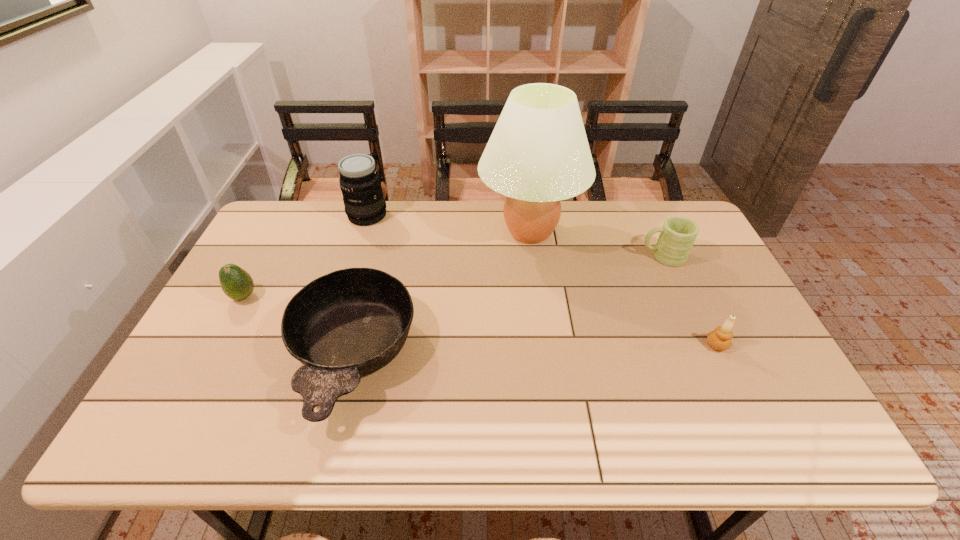
At what (x,y) coordinates should I click in order to perform the action: click on vacant area situated 0.210m on the right of the fifth shortest object. Please return your answer as a coordinate pair (x, y). Image resolution: width=960 pixels, height=540 pixels. Looking at the image, I should click on (447, 215).

The image size is (960, 540). I want to click on vacant space situated on the side of the mug with the handle, so click(551, 257).

Where is `free space located 0.370m on the side of the mug with the handle`? This screenshot has height=540, width=960. free space located 0.370m on the side of the mug with the handle is located at coordinates (522, 257).

The height and width of the screenshot is (540, 960). In order to click on free space located on the side of the mug with the handle in this screenshot , I will do `click(516, 257)`.

Image resolution: width=960 pixels, height=540 pixels. Identify the location of vacant space located 0.290m on the back of the avocado. (281, 226).

The height and width of the screenshot is (540, 960). I want to click on blank space located 0.200m on the front of the candle_holder, so click(x=757, y=428).

At what (x,y) coordinates should I click in order to perform the action: click on lampshade that is at the far edge. Please return your answer as a coordinate pair (x, y). This screenshot has width=960, height=540. Looking at the image, I should click on (538, 154).

Locate an element on the screen. The image size is (960, 540). telephoto lens present at the far edge is located at coordinates (360, 183).

Locate an element on the screen. The width and height of the screenshot is (960, 540). object that is positioned at the near edge is located at coordinates (350, 323).

At what (x,y) coordinates should I click in order to perform the action: click on object situated at the left edge. Please return your answer as a coordinate pair (x, y). The image size is (960, 540). Looking at the image, I should click on (236, 283).